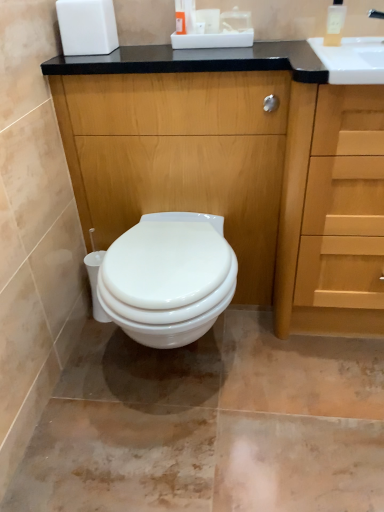
Question: Is white matte toilet paper at upper center to the left of wooden cabinet at center from the viewer's perspective?

Choices:
 (A) yes
 (B) no

Answer: (B)

Question: Is white matte toilet paper at upper center not inside wooden cabinet at center?

Choices:
 (A) no
 (B) yes

Answer: (B)

Question: Are white matte toilet paper at upper center and wooden cabinet at center located far from each other?

Choices:
 (A) no
 (B) yes

Answer: (A)

Question: Could wooden cabinet at center be considered to be inside white matte toilet paper at upper center?

Choices:
 (A) yes
 (B) no

Answer: (B)

Question: From the image's perspective, is white matte toilet paper at upper center over wooden cabinet at center?

Choices:
 (A) yes
 (B) no

Answer: (A)

Question: Is white matte toilet paper at upper center positioned with its back to wooden cabinet at center?

Choices:
 (A) yes
 (B) no

Answer: (B)

Question: Are light wood drawer at right and white matte toilet paper at upper center located far from each other?

Choices:
 (A) yes
 (B) no

Answer: (B)

Question: From the image's perspective, is light wood drawer at right on top of white matte toilet paper at upper center?

Choices:
 (A) no
 (B) yes

Answer: (A)

Question: Is light wood drawer at right thinner than white matte toilet paper at upper center?

Choices:
 (A) no
 (B) yes

Answer: (A)

Question: Is light wood drawer at right closer to camera compared to white matte toilet paper at upper center?

Choices:
 (A) no
 (B) yes

Answer: (B)

Question: Is light wood drawer at right aimed at white matte toilet paper at upper center?

Choices:
 (A) yes
 (B) no

Answer: (B)

Question: From a real-world perspective, is light wood drawer at right positioned under white matte toilet paper at upper center based on gravity?

Choices:
 (A) yes
 (B) no

Answer: (A)

Question: From a real-world perspective, does light wood drawer at right sit lower than translucent plastic soap dispenser at upper right?

Choices:
 (A) yes
 (B) no

Answer: (A)